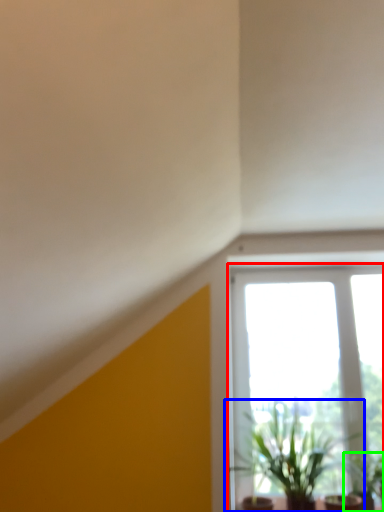
Question: Which is nearer to the window (highlighted by a red box)? houseplant (highlighted by a blue box) or houseplant (highlighted by a green box).

Choices:
 (A) houseplant
 (B) houseplant

Answer: (A)